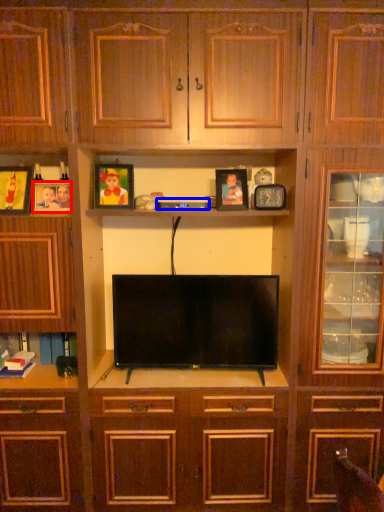
Question: Among these objects, which one is farthest to the camera, picture frame (highlighted by a red box) or appliance (highlighted by a blue box)?

Choices:
 (A) picture frame
 (B) appliance

Answer: (B)